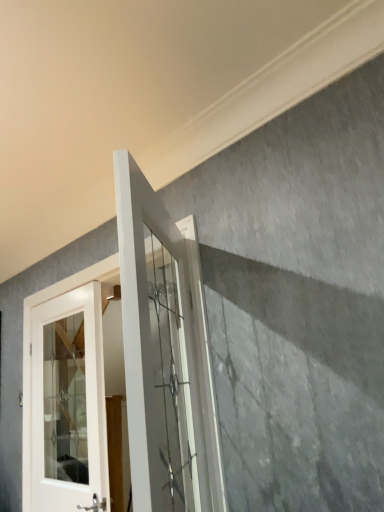
Question: Is white glass door at center, which is counted as the 2th door, starting from the left, oriented away from white glass door at left, which ranks as the 2th door in right-to-left order?

Choices:
 (A) no
 (B) yes

Answer: (A)

Question: Is white glass door at center, positioned as the first door in right-to-left order, bigger than white glass door at left, which ranks as the 2th door in right-to-left order?

Choices:
 (A) yes
 (B) no

Answer: (A)

Question: Is white glass door at center, which is counted as the 2th door, starting from the back, to the left of white glass door at left, positioned as the 1th door in back-to-front order, from the viewer's perspective?

Choices:
 (A) yes
 (B) no

Answer: (B)

Question: Does white glass door at center, which is counted as the 2th door, starting from the back, appear on the right side of white glass door at left, arranged as the 2th door when viewed from the front?

Choices:
 (A) no
 (B) yes

Answer: (B)

Question: Is the surface of white glass door at center, positioned as the first door in right-to-left order, in direct contact with white glass door at left, arranged as the 2th door when viewed from the front?

Choices:
 (A) no
 (B) yes

Answer: (A)

Question: Considering the relative sizes of white glass door at center, which is counted as the 2th door, starting from the back, and white glass door at left, which ranks as the 2th door in right-to-left order, in the image provided, is white glass door at center, which is counted as the 2th door, starting from the back, wider than white glass door at left, which ranks as the 2th door in right-to-left order,?

Choices:
 (A) no
 (B) yes

Answer: (B)

Question: Is white glass door at left, positioned as the 1th door in back-to-front order, at the left side of white glass door at center, which is counted as the 2th door, starting from the left?

Choices:
 (A) no
 (B) yes

Answer: (B)

Question: Does white glass door at left, positioned as the 1th door in back-to-front order, have a lesser height compared to white glass door at center, which is counted as the 2th door, starting from the left?

Choices:
 (A) yes
 (B) no

Answer: (B)

Question: Could you tell me if white glass door at left, which ranks as the 2th door in right-to-left order, is turned towards white glass door at center, which is counted as the 2th door, starting from the left?

Choices:
 (A) no
 (B) yes

Answer: (A)

Question: From a real-world perspective, is white glass door at left, arranged as the 2th door when viewed from the front, located higher than white glass door at center, which is counted as the 2th door, starting from the back?

Choices:
 (A) no
 (B) yes

Answer: (A)

Question: Is white glass door at left, arranged as the 2th door when viewed from the front, further to camera compared to white glass door at center, which is counted as the 2th door, starting from the back?

Choices:
 (A) yes
 (B) no

Answer: (A)

Question: Is white glass door at left, arranged as the 2th door when viewed from the front, not inside white glass door at center, which is counted as the 2th door, starting from the back?

Choices:
 (A) yes
 (B) no

Answer: (A)

Question: Considering the positions of point (152, 395) and point (61, 371), is point (152, 395) closer or farther from the camera than point (61, 371)?

Choices:
 (A) closer
 (B) farther

Answer: (A)